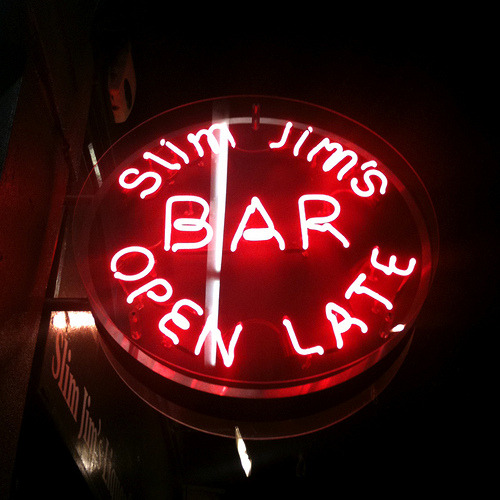
Locate an element on the screen. neon sign is located at coordinates (82, 405), (287, 237).